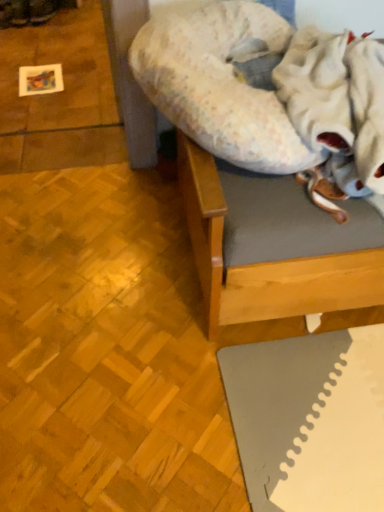
What is the approximate width of wooden bed frame at upper right?

wooden bed frame at upper right is 33.89 inches wide.

Locate an element on the screen. The height and width of the screenshot is (512, 384). fluffy white blanket at upper right is located at coordinates (337, 99).

Where is `fluffy fabric dog bed at upper center`? fluffy fabric dog bed at upper center is located at coordinates (219, 83).

Considering the positions of objects fluffy white blanket at upper right and fluffy fabric dog bed at upper center in the image provided, who is more to the left, fluffy white blanket at upper right or fluffy fabric dog bed at upper center?

Positioned to the left is fluffy fabric dog bed at upper center.

Can you confirm if fluffy white blanket at upper right is bigger than fluffy fabric dog bed at upper center?

Actually, fluffy white blanket at upper right might be smaller than fluffy fabric dog bed at upper center.

From the image's perspective, is fluffy white blanket at upper right on fluffy fabric dog bed at upper center?

No, from the image's perspective, fluffy white blanket at upper right is not over fluffy fabric dog bed at upper center.

Is fluffy fabric dog bed at upper center taller than fluffy white blanket at upper right?

Incorrect, the height of fluffy fabric dog bed at upper center is not larger of that of fluffy white blanket at upper right.

Would you say fluffy fabric dog bed at upper center is to the left or to the right of fluffy white blanket at upper right in the picture?

fluffy fabric dog bed at upper center is to the left of fluffy white blanket at upper right.

Is fluffy fabric dog bed at upper center bigger than fluffy white blanket at upper right?

Yes.

Which object is closer to the camera, fluffy fabric dog bed at upper center or fluffy white blanket at upper right?

fluffy white blanket at upper right.

Looking at this image, are fluffy white blanket at upper right and wooden bed frame at upper right making contact?

No, fluffy white blanket at upper right is not making contact with wooden bed frame at upper right.

Looking at this image, from the image's perspective, who appears lower, fluffy white blanket at upper right or wooden bed frame at upper right?

wooden bed frame at upper right.

Does fluffy white blanket at upper right contain wooden bed frame at upper right?

Actually, wooden bed frame at upper right is outside fluffy white blanket at upper right.

Considering the positions of point (292, 144) and point (221, 3), is point (292, 144) closer or farther from the camera than point (221, 3)?

Point (292, 144) is closer to the camera than point (221, 3).

Considering the sizes of objects wooden bed frame at upper right and fluffy fabric dog bed at upper center in the image provided, who is taller, wooden bed frame at upper right or fluffy fabric dog bed at upper center?

wooden bed frame at upper right.

From the image's perspective, is wooden bed frame at upper right beneath fluffy fabric dog bed at upper center?

Indeed, from the image's perspective, wooden bed frame at upper right is shown beneath fluffy fabric dog bed at upper center.

Is wooden bed frame at upper right spatially inside fluffy fabric dog bed at upper center, or outside of it?

wooden bed frame at upper right lies outside fluffy fabric dog bed at upper center.

Considering the relative positions of wooden bed frame at upper right and fluffy white blanket at upper right in the image provided, is wooden bed frame at upper right behind fluffy white blanket at upper right?

Yes, it is.

Would you say wooden bed frame at upper right contains fluffy white blanket at upper right?

Yes, wooden bed frame at upper right is surrounding fluffy white blanket at upper right.

Is wooden bed frame at upper right directly adjacent to fluffy white blanket at upper right?

No.

Choose the correct answer: Is fluffy fabric dog bed at upper center inside wooden bed frame at upper right or outside it?

fluffy fabric dog bed at upper center exists entirely within wooden bed frame at upper right.

Could you tell me if fluffy fabric dog bed at upper center is facing wooden bed frame at upper right?

Yes, fluffy fabric dog bed at upper center is aimed at wooden bed frame at upper right.

Consider the image. Is fluffy fabric dog bed at upper center not close to wooden bed frame at upper right?

No, there isn't a large distance between fluffy fabric dog bed at upper center and wooden bed frame at upper right.

From a real-world perspective, is fluffy fabric dog bed at upper center positioned over wooden bed frame at upper right based on gravity?

Indeed, from a real-world perspective, fluffy fabric dog bed at upper center stands above wooden bed frame at upper right.

Locate an element on the screen. The height and width of the screenshot is (512, 384). blanket in front of the fluffy fabric dog bed at upper center is located at coordinates (337, 99).

Locate an element on the screen. This screenshot has height=512, width=384. blanket above the fluffy fabric dog bed at upper center (from a real-world perspective) is located at coordinates (337, 99).

Estimate the real-world distances between objects in this image. Which object is further from fluffy white blanket at upper right, fluffy fabric dog bed at upper center or wooden bed frame at upper right?

wooden bed frame at upper right.

Estimate the real-world distances between objects in this image. Which object is closer to wooden bed frame at upper right, fluffy white blanket at upper right or fluffy fabric dog bed at upper center?

Among the two, fluffy fabric dog bed at upper center is located nearer to wooden bed frame at upper right.

Estimate the real-world distances between objects in this image. Which object is closer to fluffy fabric dog bed at upper center, fluffy white blanket at upper right or wooden bed frame at upper right?

wooden bed frame at upper right lies closer to fluffy fabric dog bed at upper center than the other object.

When comparing their distances from fluffy fabric dog bed at upper center, does wooden bed frame at upper right or fluffy white blanket at upper right seem further?

Among the two, fluffy white blanket at upper right is located further to fluffy fabric dog bed at upper center.

Considering their positions, is wooden bed frame at upper right positioned closer to fluffy white blanket at upper right than fluffy fabric dog bed at upper center?

fluffy fabric dog bed at upper center lies closer to fluffy white blanket at upper right than the other object.

Considering their positions, is fluffy fabric dog bed at upper center positioned closer to wooden bed frame at upper right than fluffy white blanket at upper right?

fluffy fabric dog bed at upper center is closer to wooden bed frame at upper right.

Locate an element on the screen. This screenshot has height=512, width=384. blanket between fluffy fabric dog bed at upper center and wooden bed frame at upper right is located at coordinates (337, 99).